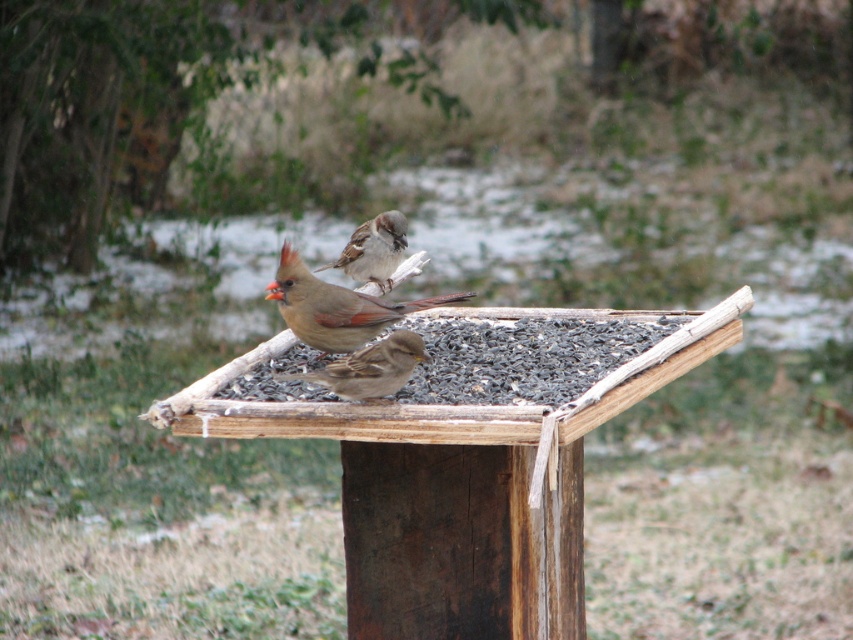
You are observing two birds on a wooden bird feeder. Which one is more to the right, the brown speckled sparrow at center or the brown matte sparrow at center?

The brown speckled sparrow at center is positioned on the right side of the brown matte sparrow at center, so it is more to the right.

You are a birdwatcher observing the two sparrows at the bird feeder. Which of the two sparrows, the brown speckled sparrow at center or the brown feathered sparrow at center, is larger in size?

The brown speckled sparrow at center is bigger than the brown feathered sparrow at center.

You are a bird trying to land on the wooden bird feeder. There are two points marked on the feeder where you can land. The first point is at coordinates point (358, 358) and the second point is at coordinates point (380, 289). Which point is closer to you as you approach the feeder from the front?

Point (358, 358) is in front of point (380, 289), so it is closer to you as you approach the feeder from the front.